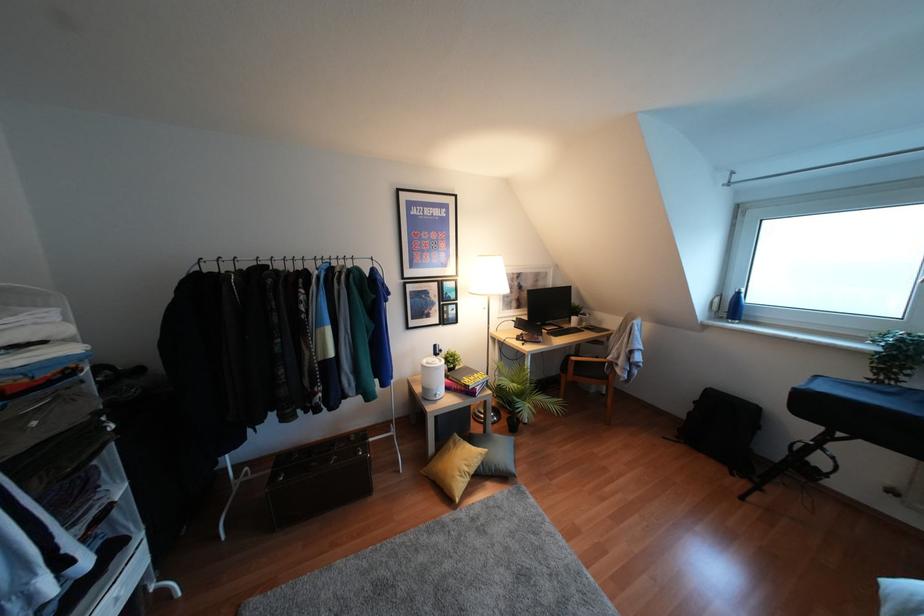
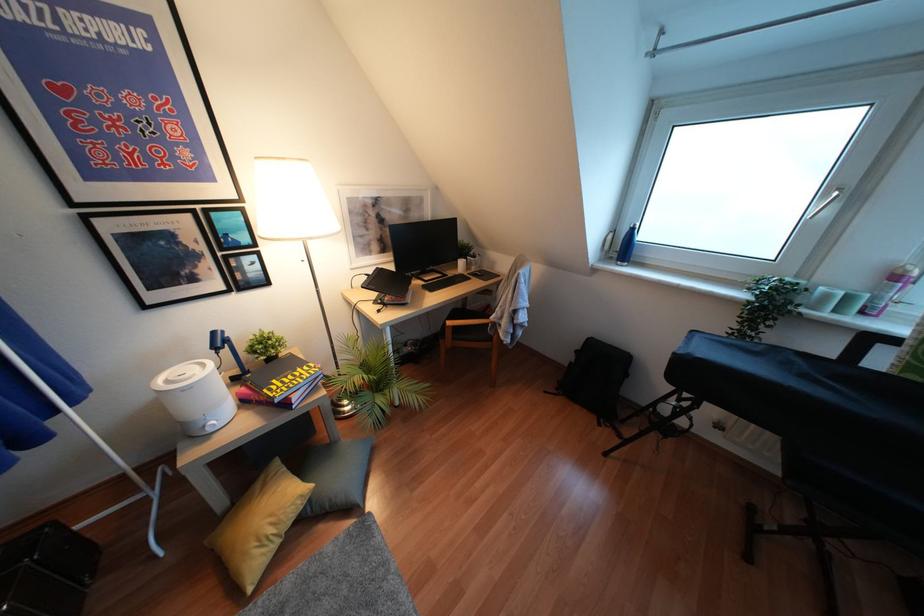
Find the pixel in the second image that matches point (466, 469) in the first image.

(271, 530)